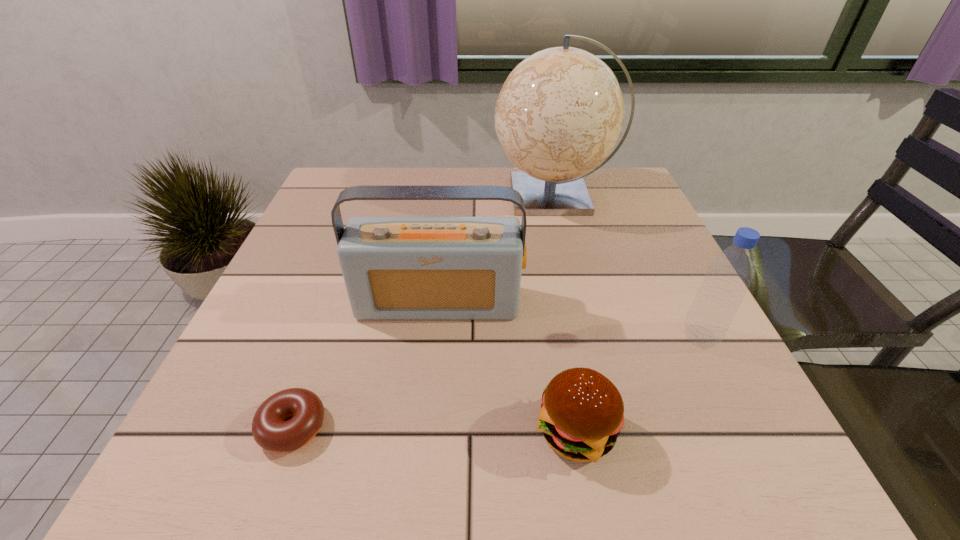
At what (x,y) coordinates should I click in order to perform the action: click on free area in between the radio receiver and the bottle. Please return your answer as a coordinate pair (x, y). The width and height of the screenshot is (960, 540). Looking at the image, I should click on (569, 320).

Identify the location of blank region between the radio receiver and the doughnut. (366, 365).

Where is `free space that is in between the hamburger and the globe`? The width and height of the screenshot is (960, 540). free space that is in between the hamburger and the globe is located at coordinates (565, 313).

Identify the location of unoccupied position between the hamburger and the shortest object. The height and width of the screenshot is (540, 960). (435, 429).

The width and height of the screenshot is (960, 540). Identify the location of vacant space that is in between the farthest object and the rightmost object. (627, 266).

Locate which object ranks fourth in proximity to the fourth tallest object. Please provide its 2D coordinates. Your answer should be formatted as a tuple, i.e. [(x, y)], where the tuple contains the x and y coordinates of a point satisfying the conditions above.

[(560, 112)]

Identify the location of the second closest object relative to the doughnut. Image resolution: width=960 pixels, height=540 pixels. (582, 413).

Where is `vacant space that satisfies the following two spatial constraints: 1. on the front-facing side of the radio receiver; 2. on the right side of the fourth tallest object`? This screenshot has width=960, height=540. vacant space that satisfies the following two spatial constraints: 1. on the front-facing side of the radio receiver; 2. on the right side of the fourth tallest object is located at coordinates (425, 431).

Identify the location of vacant space that satisfies the following two spatial constraints: 1. on the surface of the farthest object showing Europe and Africa; 2. on the front-facing side of the radio receiver. (580, 303).

Find the location of a particular element. free space that satisfies the following two spatial constraints: 1. on the surface of the tallest object showing Europe and Africa; 2. on the left side of the bottle is located at coordinates (588, 337).